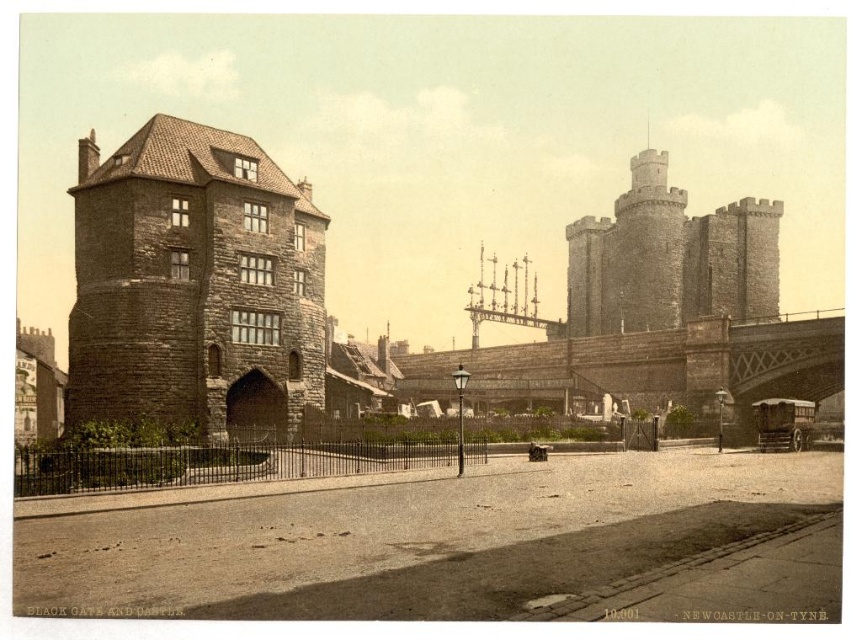
You are a tourist standing in front of the Black Gate and Castle in Newcastle. You see the brown stone tower at left and the brown stone bridge at center. Which object is located to the left of the other?

The brown stone tower at left is positioned on the left side of the brown stone bridge at center.

You are standing at the Black Gate in Newcastle and want to walk towards the Castle. The path leads you past two points marked as point (x=267, y=285) and point (x=676, y=336). Which point should you pass first?

You should pass point (x=267, y=285) first because it is in front of point (x=676, y=336) along your path towards the Castle.